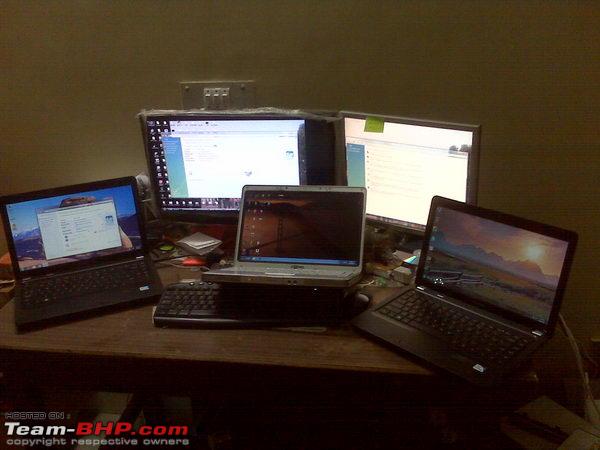
Locate an element on the screen. The image size is (600, 450). wall switch is located at coordinates (218, 99).